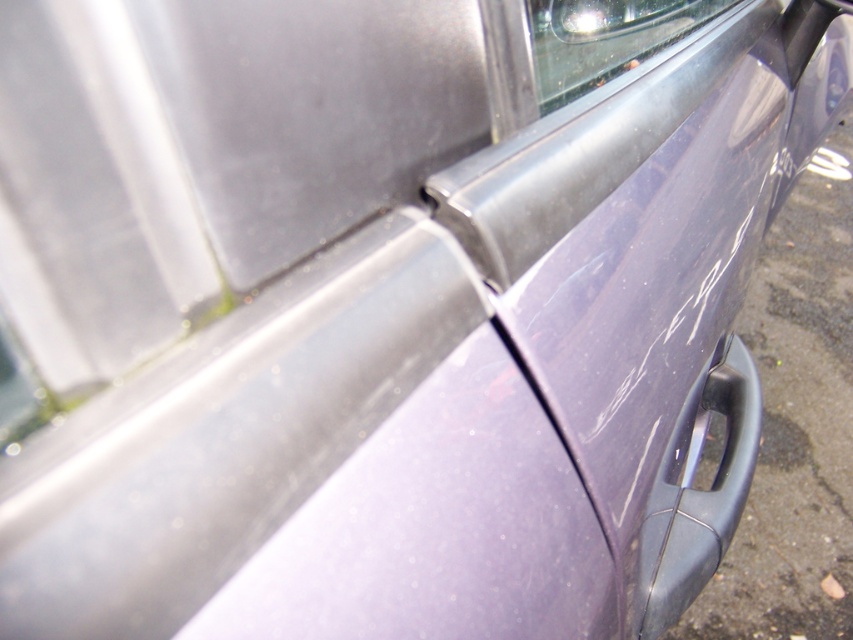
You are trying to determine the relative sizes of the satin black door handle at lower right and the clear glass window at upper center in the car door image. Which object is taller?

The satin black door handle at lower right is taller than the clear glass window at upper center.

You are trying to open the car door but can only reach the area near the clear glass window at upper center. Based on the scene description, can you reach the satin black door handle at lower right from your current position?

The satin black door handle at lower right is to the right of the clear glass window at upper center, so if you move your hand towards the right from the clear glass window at upper center, you should be able to reach the satin black door handle at lower right.

You are a delivery person trying to place a package on the car. The package is 20 inches long. Can you fit the package horizontally between the satin black door handle at lower right and the clear glass window at upper center?

The distance between the satin black door handle at lower right and the clear glass window at upper center is 22.32 inches. Since the package is 20 inches long, it can fit horizontally between them as there is enough space.